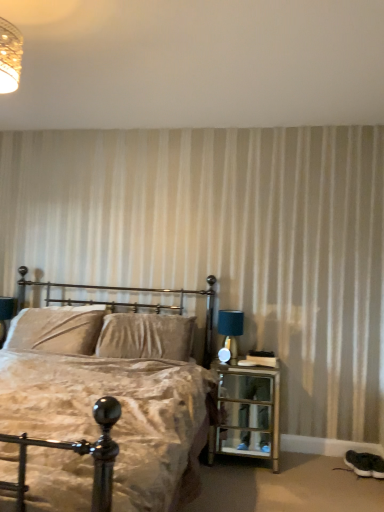
Question: From a real-world perspective, is blue fabric table lamp at right physically above velvet beige pillow at center, the 1th pillow viewed from the left?

Choices:
 (A) no
 (B) yes

Answer: (B)

Question: Is blue fabric table lamp at right facing away from velvet beige pillow at center, the 1th pillow viewed from the left?

Choices:
 (A) yes
 (B) no

Answer: (B)

Question: Is blue fabric table lamp at right oriented towards velvet beige pillow at center, the 1th pillow viewed from the left?

Choices:
 (A) yes
 (B) no

Answer: (B)

Question: Is blue fabric table lamp at right taller than velvet beige pillow at center, the 1th pillow viewed from the left?

Choices:
 (A) no
 (B) yes

Answer: (A)

Question: Is there a large distance between blue fabric table lamp at right and velvet beige pillow at center, the 1th pillow viewed from the left?

Choices:
 (A) no
 (B) yes

Answer: (B)

Question: Considering the relative sizes of blue fabric table lamp at right and velvet beige pillow at center, marked as the 2th pillow in a right-to-left arrangement, in the image provided, is blue fabric table lamp at right wider than velvet beige pillow at center, marked as the 2th pillow in a right-to-left arrangement,?

Choices:
 (A) no
 (B) yes

Answer: (A)

Question: Considering the relative sizes of white textured wall at upper center and velvet beige pillow at center, which is the second pillow from left to right, in the image provided, is white textured wall at upper center smaller than velvet beige pillow at center, which is the second pillow from left to right,?

Choices:
 (A) yes
 (B) no

Answer: (B)

Question: From a real-world perspective, is white textured wall at upper center positioned under velvet beige pillow at center, which is the second pillow from left to right, based on gravity?

Choices:
 (A) no
 (B) yes

Answer: (A)

Question: Is white textured wall at upper center taller than velvet beige pillow at center, which is the 1th pillow in right-to-left order?

Choices:
 (A) yes
 (B) no

Answer: (B)

Question: From the image's perspective, does white textured wall at upper center appear higher than velvet beige pillow at center, which is the 1th pillow in right-to-left order?

Choices:
 (A) yes
 (B) no

Answer: (A)

Question: Is white textured wall at upper center closer to the viewer compared to velvet beige pillow at center, which is the 1th pillow in right-to-left order?

Choices:
 (A) no
 (B) yes

Answer: (B)

Question: Can you confirm if white textured wall at upper center is wider than velvet beige pillow at center, which is the 1th pillow in right-to-left order?

Choices:
 (A) no
 (B) yes

Answer: (B)

Question: Is velvet beige bed at center outside of white textured wall at upper center?

Choices:
 (A) no
 (B) yes

Answer: (B)